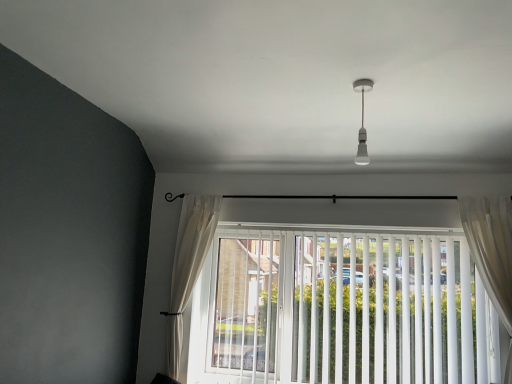
Question: Is sheer white curtain at right, the 1th curtain positioned from the front, bigger than white vertical blinds at center?

Choices:
 (A) no
 (B) yes

Answer: (A)

Question: Considering the relative positions of sheer white curtain at right, which is the first curtain in right-to-left order, and white vertical blinds at center in the image provided, is sheer white curtain at right, which is the first curtain in right-to-left order, to the right of white vertical blinds at center from the viewer's perspective?

Choices:
 (A) no
 (B) yes

Answer: (B)

Question: Is sheer white curtain at right, the 2th curtain in the left-to-right sequence, positioned far away from white vertical blinds at center?

Choices:
 (A) no
 (B) yes

Answer: (A)

Question: Can you confirm if sheer white curtain at right, which is the first curtain in right-to-left order, is shorter than white vertical blinds at center?

Choices:
 (A) yes
 (B) no

Answer: (B)

Question: Considering the relative positions of sheer white curtain at right, the 1th curtain positioned from the front, and white vertical blinds at center in the image provided, is sheer white curtain at right, the 1th curtain positioned from the front, to the left of white vertical blinds at center from the viewer's perspective?

Choices:
 (A) yes
 (B) no

Answer: (B)

Question: Is sheer white curtain at right, the 1th curtain positioned from the front, oriented towards white vertical blinds at center?

Choices:
 (A) yes
 (B) no

Answer: (B)

Question: Can you confirm if white glossy bulb at upper center is taller than white sheer curtain at left, the second curtain positioned from the front?

Choices:
 (A) yes
 (B) no

Answer: (B)

Question: From a real-world perspective, does white glossy bulb at upper center sit lower than white sheer curtain at left, the 2th curtain viewed from the right?

Choices:
 (A) yes
 (B) no

Answer: (B)

Question: Considering the relative positions of white glossy bulb at upper center and white sheer curtain at left, the 2th curtain viewed from the right, in the image provided, is white glossy bulb at upper center in front of white sheer curtain at left, the 2th curtain viewed from the right,?

Choices:
 (A) yes
 (B) no

Answer: (A)

Question: Is white glossy bulb at upper center outside of white sheer curtain at left, positioned as the first curtain in left-to-right order?

Choices:
 (A) no
 (B) yes

Answer: (B)

Question: Is white glossy bulb at upper center turned away from white sheer curtain at left, the first curtain when ordered from back to front?

Choices:
 (A) yes
 (B) no

Answer: (B)

Question: Does white glossy bulb at upper center have a greater width compared to white sheer curtain at left, the first curtain when ordered from back to front?

Choices:
 (A) yes
 (B) no

Answer: (B)

Question: From the image's perspective, is white sheer curtain at left, the second curtain positioned from the front, below white vertical blinds at center?

Choices:
 (A) yes
 (B) no

Answer: (B)